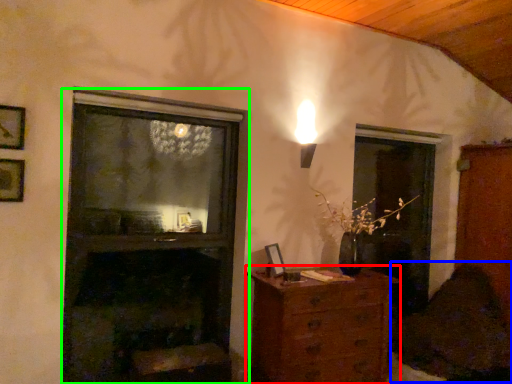
Question: Which object is positioned closest to chest of drawers (highlighted by a red box)? Select from swivel chair (highlighted by a blue box) and fireplace (highlighted by a green box).

Choices:
 (A) swivel chair
 (B) fireplace

Answer: (B)